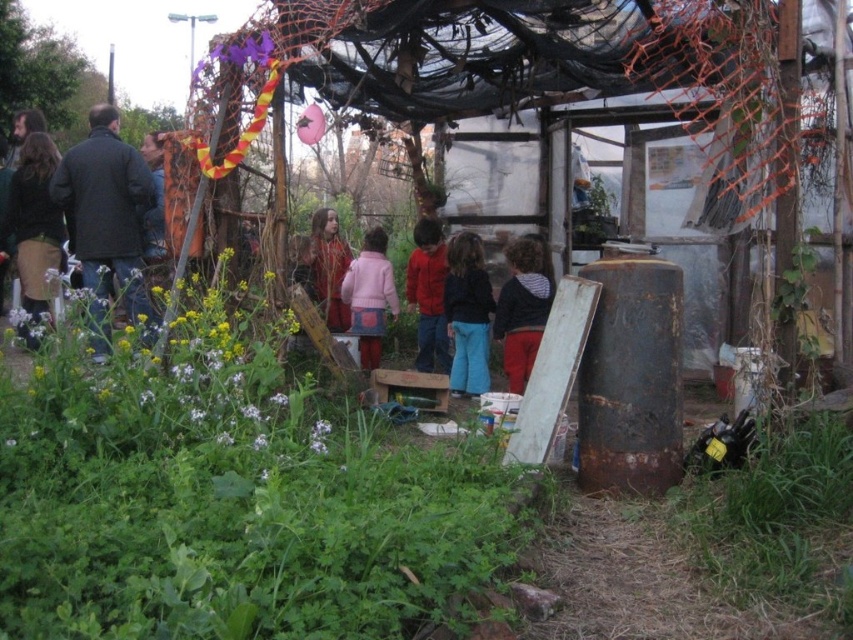
Does pink matte jacket at center have a larger size compared to brown textured coat at center?

Actually, pink matte jacket at center might be smaller than brown textured coat at center.

Can you confirm if pink matte jacket at center is wider than brown textured coat at center?

Yes, pink matte jacket at center is wider than brown textured coat at center.

You are a GUI agent. You are given a task and a screenshot of the screen. Output one action in this format:
    pyautogui.click(x=<x>, y=<y>)
    Task: Click on the pink matte jacket at center
    
    Given the screenshot: What is the action you would take?
    pyautogui.click(x=370, y=296)

The image size is (853, 640). I want to click on pink matte jacket at center, so click(370, 296).

From the picture: Can you confirm if green leafy plant at lower left is thinner than striped fleece jacket at center?

In fact, green leafy plant at lower left might be wider than striped fleece jacket at center.

Is green leafy plant at lower left bigger than striped fleece jacket at center?

Yes.

Is point (178, 321) positioned after point (511, 376)?

No, it is not.

What are the coordinates of `green leafy plant at lower left` in the screenshot? It's located at (160, 388).

Is the position of green leafy plant at lower left less distant than that of blue denim pants at center?

That is True.

Who is more forward, (x=142, y=406) or (x=450, y=276)?

Point (x=142, y=406)

Locate an element on the screen. This screenshot has width=853, height=640. green leafy plant at lower left is located at coordinates (160, 388).

Locate an element on the screen. The image size is (853, 640). green leafy plant at lower left is located at coordinates (160, 388).